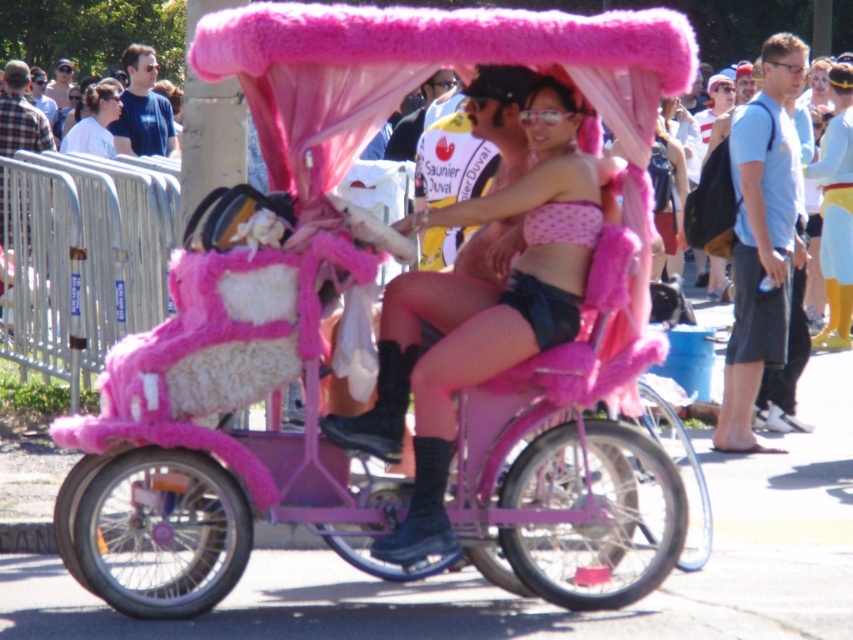
You are a fashion designer observing the image. You need to determine the placement of the matte pink fur coat at center and the blue cotton shirt at upper left for a runway show. Which item is positioned lower in the image?

The matte pink fur coat at center is located below the blue cotton shirt at upper left, so the matte pink fur coat at center is positioned lower in the image.

You are standing in front of the bicycle and want to place a small sticker exactly at the point labeled point (x=457, y=364). Based on the scene description, where would this sticker be placed?

The point (x=457, y=364) is on the matte pink fur coat at center, so the sticker would be placed on the matte pink fur coat at center.

You are trying to locate the blue fabric backpack at right and the matte white shirt at upper left in the image. Based on their positions, which object is closer to the bottom of the image?

The blue fabric backpack at right is below matte white shirt at upper left, so the blue fabric backpack at right is closer to the bottom of the image.